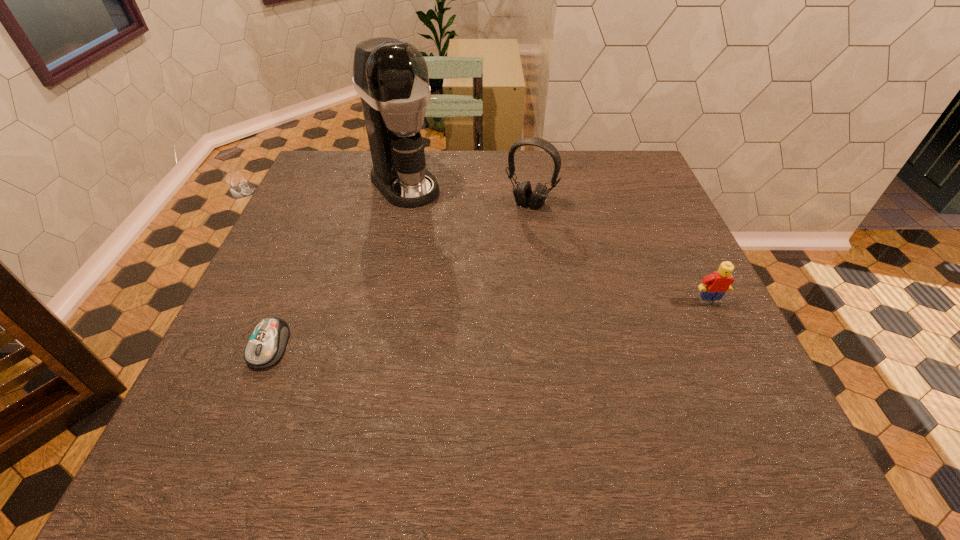
At what (x,y) coordinates should I click in order to perform the action: click on the leftmost object. Please return your answer as a coordinate pair (x, y). The width and height of the screenshot is (960, 540). Looking at the image, I should click on (266, 345).

Where is `the shortest object`? This screenshot has height=540, width=960. the shortest object is located at coordinates (266, 345).

The image size is (960, 540). I want to click on the second shortest object, so click(714, 286).

Locate an element on the screen. The width and height of the screenshot is (960, 540). Lego is located at coordinates (714, 286).

I want to click on the second object from right to left, so click(x=523, y=194).

The width and height of the screenshot is (960, 540). What are the coordinates of `headset` in the screenshot? It's located at (523, 194).

What are the coordinates of `coffee maker` in the screenshot? It's located at (391, 77).

I want to click on the third object from right to left, so click(391, 77).

Image resolution: width=960 pixels, height=540 pixels. I want to click on vacant space positioned on the wheel side of the shortest object, so click(248, 399).

Identify the location of free space located on the front-facing side of the Lego. Image resolution: width=960 pixels, height=540 pixels. (722, 327).